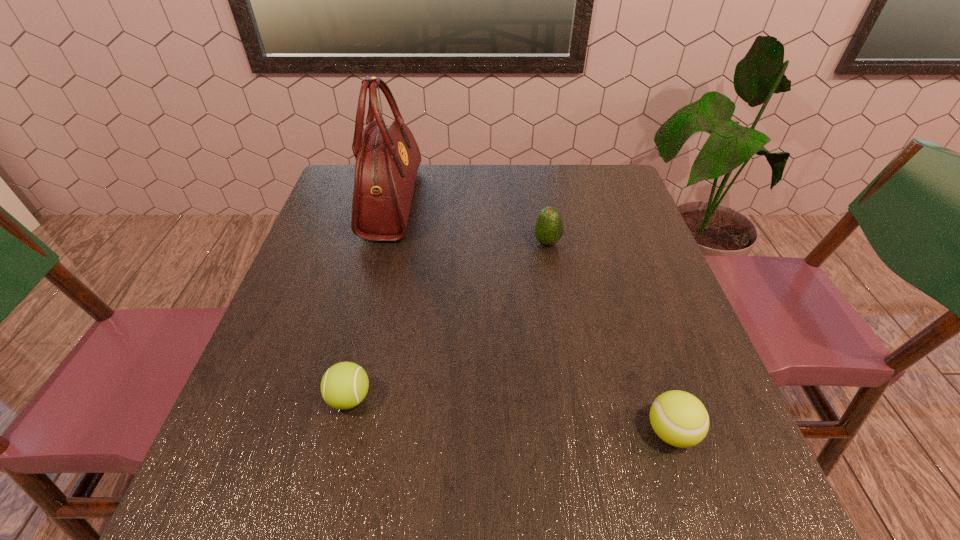
Where is `the tallest object`? the tallest object is located at coordinates [387, 158].

Where is `the second tallest object`? The width and height of the screenshot is (960, 540). the second tallest object is located at coordinates (549, 228).

In order to click on the second object from right to left in this screenshot , I will do `click(549, 228)`.

The width and height of the screenshot is (960, 540). Identify the location of the right tennis ball. (680, 419).

Locate an element on the screen. The image size is (960, 540). the left tennis ball is located at coordinates (344, 385).

Where is `free location located on the front-facing side of the tallest object`? This screenshot has width=960, height=540. free location located on the front-facing side of the tallest object is located at coordinates (463, 202).

At what (x,y) coordinates should I click in order to perform the action: click on free region located on the back of the second object from right to left. Please return your answer as a coordinate pair (x, y). This screenshot has height=540, width=960. Looking at the image, I should click on (534, 166).

In order to click on blank area located on the front of the right tennis ball in this screenshot , I will do `click(701, 524)`.

This screenshot has height=540, width=960. Find the location of `free space located 0.270m on the back of the left tennis ball`. free space located 0.270m on the back of the left tennis ball is located at coordinates tap(378, 279).

I want to click on object positioned at the far edge, so click(x=387, y=158).